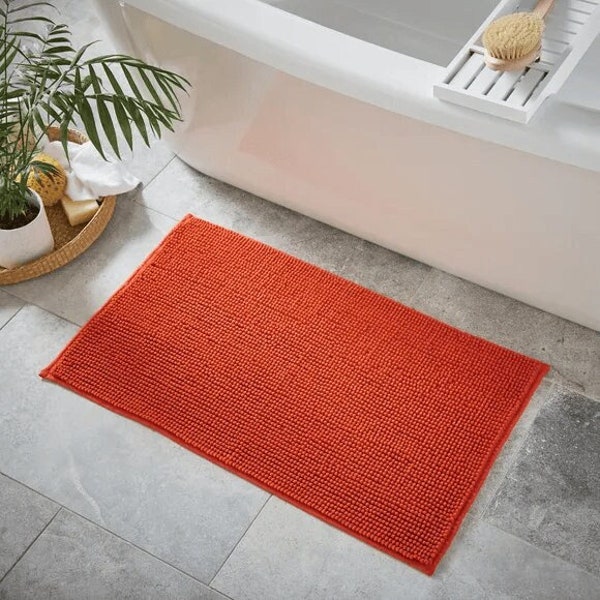
Identify the location of white cloth. Image resolution: width=600 pixels, height=600 pixels. (109, 177).